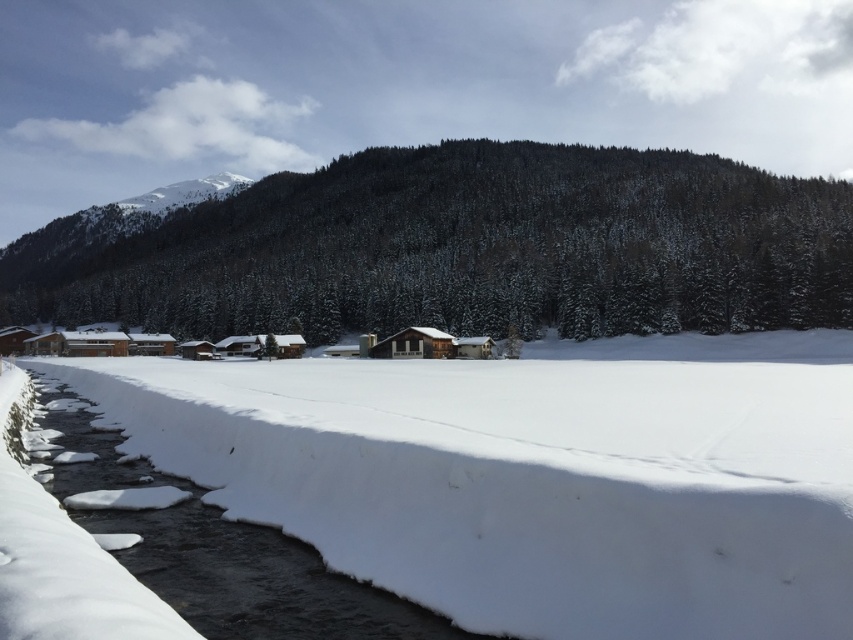
Which of these two, snow-covered forest at center or wooden cabin at center, stands taller?

With more height is snow-covered forest at center.

Is point (372, 275) closer to viewer compared to point (410, 333)?

No, it is behind (410, 333).

Image resolution: width=853 pixels, height=640 pixels. I want to click on snow-covered forest at center, so click(x=457, y=248).

The height and width of the screenshot is (640, 853). What are the coordinates of `snow-covered forest at center` in the screenshot? It's located at (457, 248).

Is point (695, 429) positioned after point (573, 163)?

No, it is in front of (573, 163).

Between white fluffy snow at lower left and snow-covered forest at center, which one is positioned higher?

Positioned higher is snow-covered forest at center.

This screenshot has width=853, height=640. What do you see at coordinates (535, 476) in the screenshot? I see `white fluffy snow at lower left` at bounding box center [535, 476].

In order to click on white fluffy snow at lower left in this screenshot , I will do `click(535, 476)`.

Does white fluffy snow at lower left lie behind wooden cabin at center?

No.

Who is more distant from viewer, (666,596) or (381,340)?

Point (381,340)

Locate an element on the screen. This screenshot has height=640, width=853. white fluffy snow at lower left is located at coordinates (535, 476).